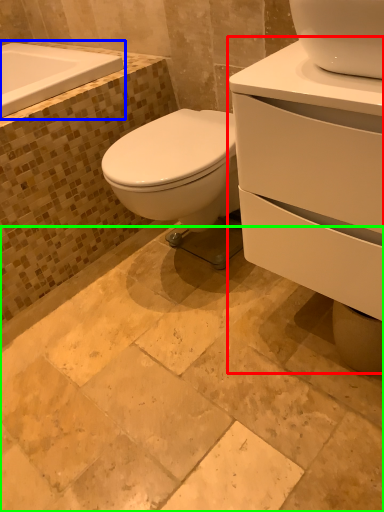
Question: Estimate the real-world distances between objects in this image. Which object is farther from porcelain (highlighted by a red box), bath (highlighted by a blue box) or ceramic tile (highlighted by a green box)?

Choices:
 (A) bath
 (B) ceramic tile

Answer: (A)